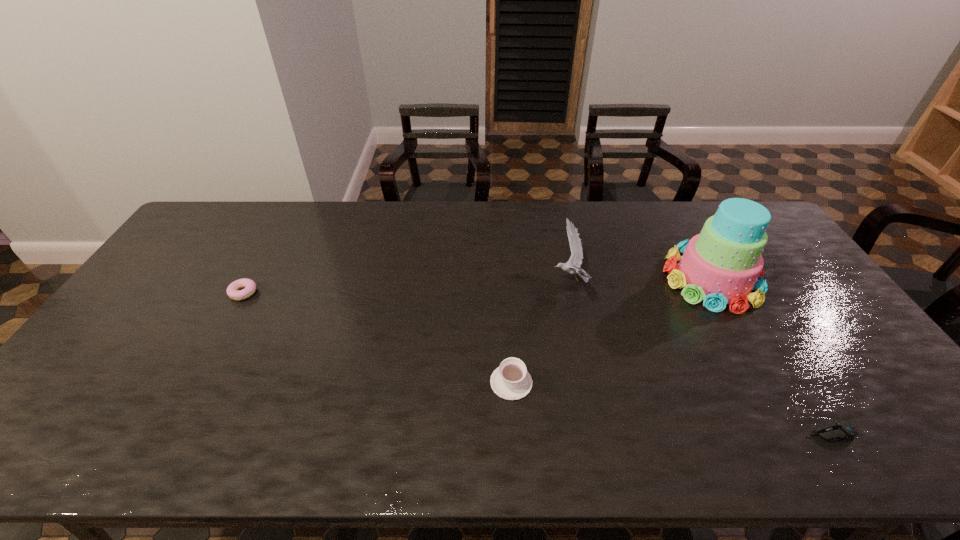
At what (x,y) coordinates should I click in order to perform the action: click on free space that is in between the teacup and the cake. Please return your answer as a coordinate pair (x, y). Image resolution: width=960 pixels, height=540 pixels. Looking at the image, I should click on (612, 330).

This screenshot has height=540, width=960. In order to click on free space between the computer mouse and the tallest object in this screenshot , I will do `click(771, 356)`.

Select which object appears as the third closest to the computer mouse. Please provide its 2D coordinates. Your answer should be formatted as a tuple, i.e. [(x, y)], where the tuple contains the x and y coordinates of a point satisfying the conditions above.

[(511, 381)]

Where is `the closest object to the third object from right to left`? The width and height of the screenshot is (960, 540). the closest object to the third object from right to left is located at coordinates (511, 381).

The image size is (960, 540). Find the location of `vacant space that satisfies the following two spatial constraints: 1. at the tip of the beak of the nearest object; 2. on the right side of the fourth shortest object`. vacant space that satisfies the following two spatial constraints: 1. at the tip of the beak of the nearest object; 2. on the right side of the fourth shortest object is located at coordinates coord(604,433).

Where is `vacant space that satisfies the following two spatial constraints: 1. at the tip of the beak of the third object from right to left; 2. on the back side of the nearest object`? vacant space that satisfies the following two spatial constraints: 1. at the tip of the beak of the third object from right to left; 2. on the back side of the nearest object is located at coordinates (604, 433).